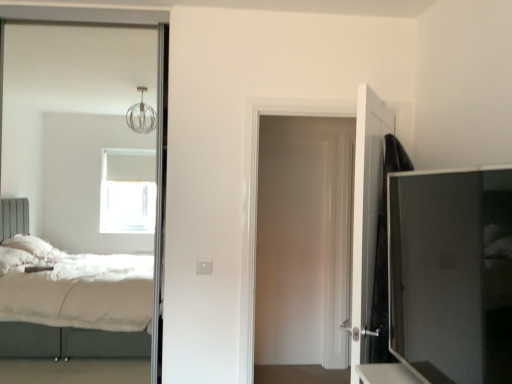
Question: Is black matte door at right, which ranks as the 1th door in front-to-back order, facing towards white glossy door at center, which is counted as the first door, starting from the back?

Choices:
 (A) no
 (B) yes

Answer: (B)

Question: From a real-world perspective, is black matte door at right, marked as the 2th door in a back-to-front arrangement, beneath white glossy door at center, positioned as the 2th door in front-to-back order?

Choices:
 (A) no
 (B) yes

Answer: (B)

Question: Is black matte door at right, which ranks as the 1th door in front-to-back order, not within white glossy door at center, which is counted as the first door, starting from the back?

Choices:
 (A) yes
 (B) no

Answer: (A)

Question: Does black matte door at right, marked as the 2th door in a back-to-front arrangement, have a greater height compared to white glossy door at center, which is counted as the first door, starting from the back?

Choices:
 (A) yes
 (B) no

Answer: (B)

Question: Is black matte door at right, which ranks as the 1th door in front-to-back order, to the right of white glossy door at center, which is counted as the first door, starting from the back, from the viewer's perspective?

Choices:
 (A) no
 (B) yes

Answer: (B)

Question: Does black matte door at right, which ranks as the 1th door in front-to-back order, have a smaller size compared to white glossy door at center, positioned as the 2th door in front-to-back order?

Choices:
 (A) no
 (B) yes

Answer: (A)

Question: From the image's perspective, is white glossy door at center, which is counted as the first door, starting from the back, below black matte door at right, marked as the 2th door in a back-to-front arrangement?

Choices:
 (A) yes
 (B) no

Answer: (B)

Question: Is black matte door at right, marked as the 2th door in a back-to-front arrangement, completely or partially inside white glossy door at center, which is counted as the first door, starting from the back?

Choices:
 (A) no
 (B) yes

Answer: (A)

Question: Considering the relative sizes of white glossy door at center, which is counted as the first door, starting from the back, and black matte door at right, marked as the 2th door in a back-to-front arrangement, in the image provided, is white glossy door at center, which is counted as the first door, starting from the back, bigger than black matte door at right, marked as the 2th door in a back-to-front arrangement,?

Choices:
 (A) no
 (B) yes

Answer: (A)

Question: Is the depth of white glossy door at center, which is counted as the first door, starting from the back, less than that of black matte door at right, which ranks as the 1th door in front-to-back order?

Choices:
 (A) no
 (B) yes

Answer: (A)

Question: Is white glossy door at center, which is counted as the first door, starting from the back, to the right of black matte door at right, which ranks as the 1th door in front-to-back order, from the viewer's perspective?

Choices:
 (A) yes
 (B) no

Answer: (B)

Question: Does white glossy door at center, which is counted as the first door, starting from the back, appear on the left side of black matte door at right, which ranks as the 1th door in front-to-back order?

Choices:
 (A) no
 (B) yes

Answer: (B)

Question: Can you confirm if black matte door at right, which ranks as the 1th door in front-to-back order, is shorter than matte black tv cabinet at right?

Choices:
 (A) yes
 (B) no

Answer: (B)